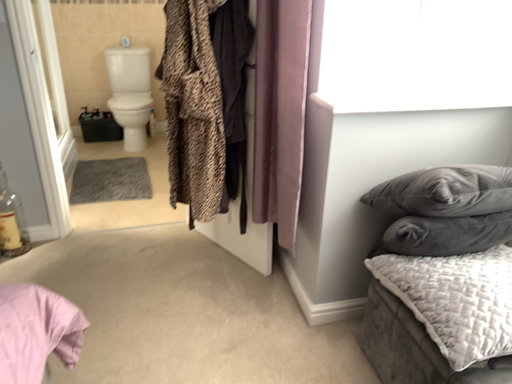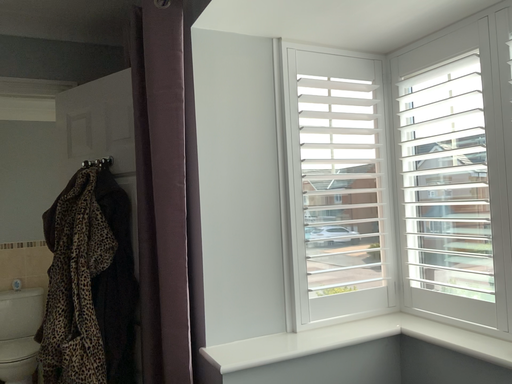
Question: How did the camera likely rotate when shooting the video?

Choices:
 (A) rotated downward
 (B) rotated upward

Answer: (B)